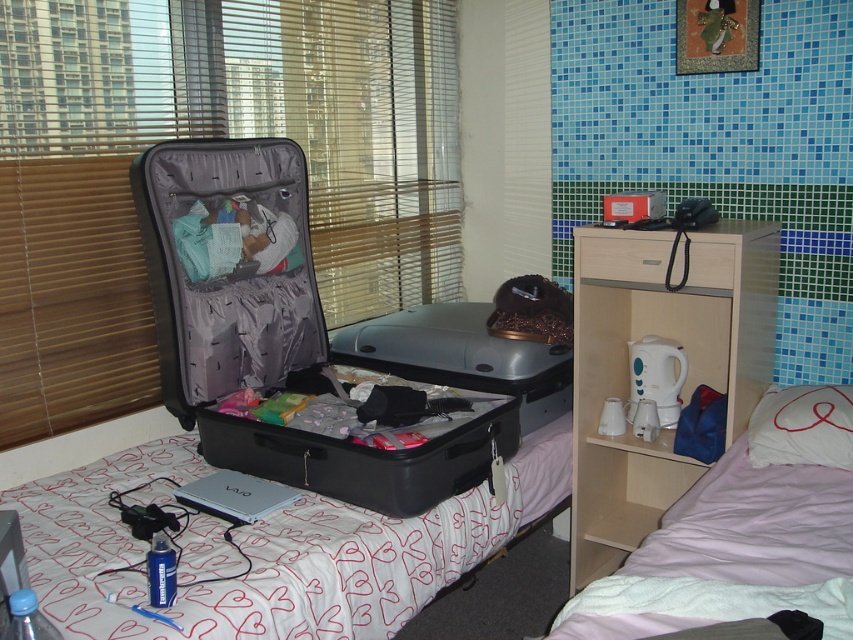
Does point (236, 419) come farther from viewer compared to point (703, 260)?

No, (236, 419) is in front of (703, 260).

Between point (244, 352) and point (648, 268), which one is positioned behind?

The point (244, 352) is behind.

Where is `black matte suitcase at center`? The height and width of the screenshot is (640, 853). black matte suitcase at center is located at coordinates (x=270, y=326).

Between white heart-patterned fabric at center and wooden drawer at center, which one appears on the left side from the viewer's perspective?

From the viewer's perspective, white heart-patterned fabric at center appears more on the left side.

Where is `white heart-patterned fabric at center`? This screenshot has height=640, width=853. white heart-patterned fabric at center is located at coordinates (273, 548).

Locate an element on the screen. white heart-patterned fabric at center is located at coordinates (273, 548).

Which of these two, black matte suitcase at center or matte black suitcase at center, stands shorter?

With less height is matte black suitcase at center.

Where is `black matte suitcase at center`? The height and width of the screenshot is (640, 853). black matte suitcase at center is located at coordinates (270, 326).